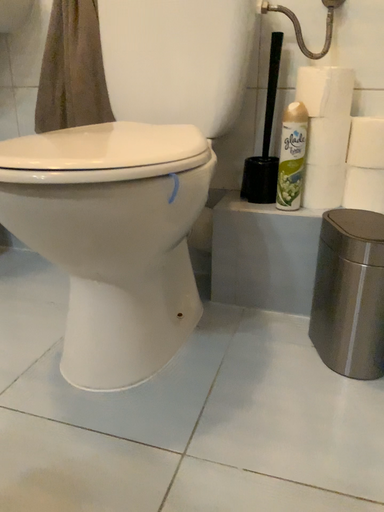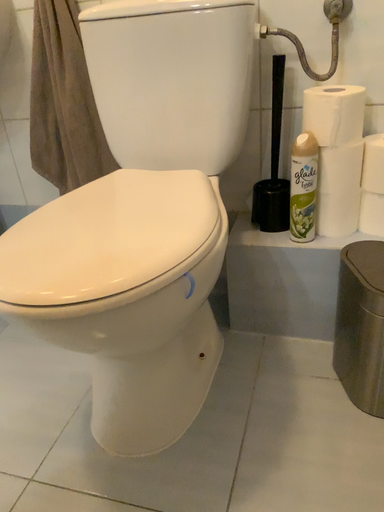
Question: How did the camera likely rotate when shooting the video?

Choices:
 (A) rotated upward
 (B) rotated downward

Answer: (B)